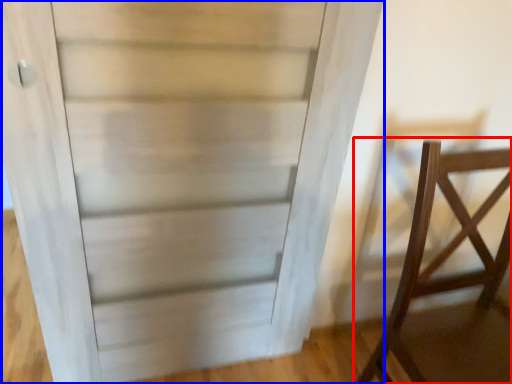
Question: Which object appears closest to the camera in this image, furniture (highlighted by a red box) or door (highlighted by a blue box)?

Choices:
 (A) furniture
 (B) door

Answer: (A)